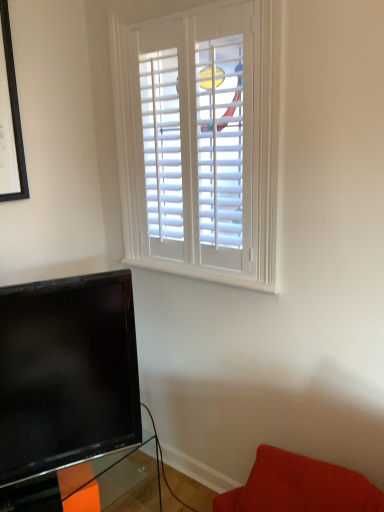
The height and width of the screenshot is (512, 384). Describe the element at coordinates (300, 487) in the screenshot. I see `velvety red cushion at lower right` at that location.

Locate an element on the screen. velvety red cushion at lower right is located at coordinates (x=300, y=487).

Locate an element on the screen. The height and width of the screenshot is (512, 384). transparent glass table at lower left is located at coordinates (94, 485).

What do you see at coordinates (94, 485) in the screenshot? I see `transparent glass table at lower left` at bounding box center [94, 485].

Measure the distance between point (156, 484) and camera.

A distance of 6.77 feet exists between point (156, 484) and camera.

You are a GUI agent. You are given a task and a screenshot of the screen. Output one action in this format:
    pyautogui.click(x=<x>, y=<y>)
    Task: Click on the velvety red cushion at lower right
    The height and width of the screenshot is (512, 384).
    Given the screenshot: What is the action you would take?
    pyautogui.click(x=300, y=487)

Which object is positioned more to the left, velvety red cushion at lower right or transparent glass table at lower left?

Answer: transparent glass table at lower left.

Between velvety red cushion at lower right and transparent glass table at lower left, which one is positioned behind?

transparent glass table at lower left is more distant.

Does point (277, 499) appear closer or farther from the camera than point (134, 472)?

Point (277, 499) is positioned closer to the camera compared to point (134, 472).

From the image's perspective, is velvety red cushion at lower right above or below transparent glass table at lower left?

velvety red cushion at lower right is situated higher than transparent glass table at lower left in the image.

From a real-world perspective, does velvety red cushion at lower right sit lower than transparent glass table at lower left?

Actually, velvety red cushion at lower right is physically above transparent glass table at lower left in the real world.

Considering the relative sizes of velvety red cushion at lower right and transparent glass table at lower left in the image provided, is velvety red cushion at lower right wider than transparent glass table at lower left?

Incorrect, the width of velvety red cushion at lower right does not surpass that of transparent glass table at lower left.

Considering the sizes of velvety red cushion at lower right and transparent glass table at lower left in the image, is velvety red cushion at lower right taller or shorter than transparent glass table at lower left?

Clearly, velvety red cushion at lower right is shorter compared to transparent glass table at lower left.

Is velvety red cushion at lower right smaller than transparent glass table at lower left?

Indeed, velvety red cushion at lower right has a smaller size compared to transparent glass table at lower left.

Is velvety red cushion at lower right not within transparent glass table at lower left?

Yes, velvety red cushion at lower right is outside of transparent glass table at lower left.

Is velvety red cushion at lower right positioned far away from transparent glass table at lower left?

No, there isn't a large distance between velvety red cushion at lower right and transparent glass table at lower left.

Is velvety red cushion at lower right positioned with its back to transparent glass table at lower left?

No.

How different are the orientations of velvety red cushion at lower right and transparent glass table at lower left in degrees?

The angular difference between velvety red cushion at lower right and transparent glass table at lower left is 80.9 degrees.

The width and height of the screenshot is (384, 512). What are the coordinates of `table beneath the velvety red cushion at lower right (from a real-world perspective)` in the screenshot? It's located at (94, 485).

Based on their positions, is transparent glass table at lower left located to the left or right of velvety red cushion at lower right?

transparent glass table at lower left is to the left of velvety red cushion at lower right.

Considering the positions of objects transparent glass table at lower left and velvety red cushion at lower right in the image provided, who is behind, transparent glass table at lower left or velvety red cushion at lower right?

transparent glass table at lower left is further away from the camera.

Does point (39, 498) come in front of point (292, 469)?

No, (39, 498) is behind (292, 469).

From the image's perspective, does transparent glass table at lower left appear higher than velvety red cushion at lower right?

Actually, transparent glass table at lower left appears below velvety red cushion at lower right in the image.

From a real-world perspective, is transparent glass table at lower left below velvety red cushion at lower right?

Yes, from a real-world perspective, transparent glass table at lower left is under velvety red cushion at lower right.

Is transparent glass table at lower left wider than velvety red cushion at lower right?

Yes, transparent glass table at lower left is wider than velvety red cushion at lower right.

Between transparent glass table at lower left and velvety red cushion at lower right, which one has less height?

With less height is velvety red cushion at lower right.

Between transparent glass table at lower left and velvety red cushion at lower right, which one has larger size?

With larger size is transparent glass table at lower left.

From the picture: Would you say transparent glass table at lower left contains velvety red cushion at lower right?

Actually, velvety red cushion at lower right is outside transparent glass table at lower left.

Is transparent glass table at lower left not near velvety red cushion at lower right?

No, transparent glass table at lower left is not far from velvety red cushion at lower right.

Is transparent glass table at lower left oriented towards velvety red cushion at lower right?

Yes, transparent glass table at lower left is oriented towards velvety red cushion at lower right.

What's the angular difference between transparent glass table at lower left and velvety red cushion at lower right's facing directions?

The angle between the facing direction of transparent glass table at lower left and the facing direction of velvety red cushion at lower right is 80.9 degrees.

Identify the location of table that appears on the left of velvety red cushion at lower right. The width and height of the screenshot is (384, 512). (94, 485).

You are a GUI agent. You are given a task and a screenshot of the screen. Output one action in this format:
    pyautogui.click(x=<x>, y=<y>)
    Task: Click on the furniture above the transparent glass table at lower left (from the image's perspective)
    The width and height of the screenshot is (384, 512).
    Given the screenshot: What is the action you would take?
    pyautogui.click(x=300, y=487)

Identify the location of furniture that is on the right side of transparent glass table at lower left. (300, 487).